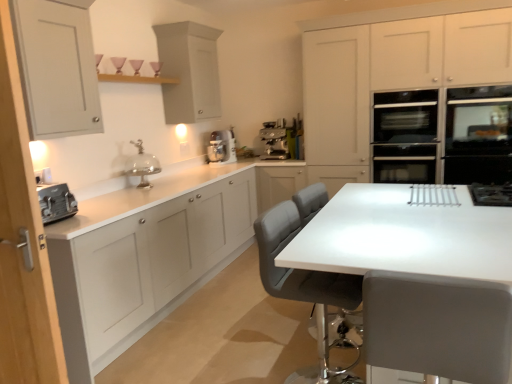
Find the location of a particular element. The width and height of the screenshot is (512, 384). satin silver espresso machine at center is located at coordinates (275, 141).

Measure the distance between point [127,285] and camera.

The depth of point [127,285] is 8.61 feet.

Locate an element on the screen. The height and width of the screenshot is (384, 512). white matte cabinetry at right, positioned as the fifth cabinetry in left-to-right order is located at coordinates (391, 70).

At what (x,y) coordinates should I click in order to perform the action: click on satin silver espresso machine at center. Please return your answer as a coordinate pair (x, y). The height and width of the screenshot is (384, 512). Looking at the image, I should click on (275, 141).

Is satin silver espresso machine at center turned away from white matte cabinetry at right, positioned as the fifth cabinetry in left-to-right order?

No, satin silver espresso machine at center's orientation is not away from white matte cabinetry at right, positioned as the fifth cabinetry in left-to-right order.

From the image's perspective, which one is positioned higher, satin silver espresso machine at center or white matte cabinetry at right, the first cabinetry from the right?

white matte cabinetry at right, the first cabinetry from the right, is shown above in the image.

Do you think satin silver espresso machine at center is within white matte cabinetry at right, the first cabinetry from the right, or outside of it?

The correct answer is: outside.

Considering the relative positions of satin silver espresso machine at center and white matte cabinetry at right, positioned as the fifth cabinetry in left-to-right order, in the image provided, is satin silver espresso machine at center to the left or to the right of white matte cabinetry at right, positioned as the fifth cabinetry in left-to-right order,?

Clearly, satin silver espresso machine at center is on the left of white matte cabinetry at right, positioned as the fifth cabinetry in left-to-right order, in the image.

Between silver metallic cake stand at center and matte white mixer at center, which one appears on the left side from the viewer's perspective?

silver metallic cake stand at center.

Which object is thinner, silver metallic cake stand at center or matte white mixer at center?

matte white mixer at center.

Is silver metallic cake stand at center not near matte white mixer at center?

Actually, silver metallic cake stand at center and matte white mixer at center are a little close together.

Measure the distance between silver metallic cake stand at center and matte white mixer at center.

silver metallic cake stand at center is 35.66 inches away from matte white mixer at center.

Looking at this image, does white matte cabinet at upper center, which ranks as the fourth cabinetry in left-to-right order, have a smaller size compared to white matte cabinet at left, the 3th cabinetry from the right?

Indeed, white matte cabinet at upper center, which ranks as the fourth cabinetry in left-to-right order, has a smaller size compared to white matte cabinet at left, the 3th cabinetry from the right.

Identify the location of cabinetry that is the 4th object located below the white matte cabinet at upper center, arranged as the 2th cabinetry when viewed from the right (from the image's perspective). The height and width of the screenshot is (384, 512). (145, 262).

Which of these two, white matte cabinet at upper center, arranged as the 2th cabinetry when viewed from the right, or white matte cabinet at left, the 3th cabinetry from the right, stands shorter?

Standing shorter between the two is white matte cabinet at upper center, arranged as the 2th cabinetry when viewed from the right.

From the image's perspective, between satin silver espresso machine at center and silver metallic cake stand at center, which one is located above?

satin silver espresso machine at center appears higher in the image.

What's the angular difference between satin silver espresso machine at center and silver metallic cake stand at center's facing directions?

There is a 90.3-degree angle between the facing directions of satin silver espresso machine at center and silver metallic cake stand at center.

This screenshot has height=384, width=512. Identify the location of faucet on the left of satin silver espresso machine at center. (141, 164).

Is satin silver espresso machine at center positioned with its back to silver metallic cake stand at center?

No, satin silver espresso machine at center's orientation is not away from silver metallic cake stand at center.

Between white matte cabinetry at right, the first cabinetry from the right, and white matte cabinet at left, the 3th cabinetry from the right, which one has smaller width?

white matte cabinet at left, the 3th cabinetry from the right, is thinner.

Is white matte cabinetry at right, the first cabinetry from the right, further to camera compared to white matte cabinet at left, the 3th cabinetry from the right?

A: Yes, it is behind white matte cabinet at left, the 3th cabinetry from the right.

Is white matte cabinetry at right, positioned as the fifth cabinetry in left-to-right order, far away from white matte cabinet at left, positioned as the 3th cabinetry in left-to-right order?

Yes.

Identify the location of cabinetry that is the 2nd object directly below the white matte cabinetry at right, positioned as the fifth cabinetry in left-to-right order (from a real-world perspective). The height and width of the screenshot is (384, 512). (145, 262).

How different are the orientations of black glass oven at right, the 2th oven viewed from the left, and black glass oven at right, arranged as the 2th oven when viewed from the right, in degrees?

0.000116 degrees separate the facing orientations of black glass oven at right, the 2th oven viewed from the left, and black glass oven at right, arranged as the 2th oven when viewed from the right.

Is black glass oven at right, acting as the first oven starting from the right, not close to black glass oven at right, which is the first oven in left-to-right order?

No, black glass oven at right, acting as the first oven starting from the right, is not far away from black glass oven at right, which is the first oven in left-to-right order.

Choose the correct answer: Is black glass oven at right, the 2th oven viewed from the left, inside black glass oven at right, arranged as the 2th oven when viewed from the right, or outside it?

black glass oven at right, the 2th oven viewed from the left, exists outside the volume of black glass oven at right, arranged as the 2th oven when viewed from the right.

Looking at this image, which object is further away from the camera, black glass oven at right, acting as the first oven starting from the right, or black glass oven at right, arranged as the 2th oven when viewed from the right?

black glass oven at right, arranged as the 2th oven when viewed from the right, is further from the camera.

Between gray leather chair at center, marked as the 1th chair in a back-to-front arrangement, and black glass oven at right, which is the first oven in left-to-right order, which one has less height?

black glass oven at right, which is the first oven in left-to-right order.

Is point (272, 269) closer to camera compared to point (397, 106)?

Yes, point (272, 269) is in front of point (397, 106).

Is gray leather chair at center, marked as the 1th chair in a back-to-front arrangement, wider than black glass oven at right, arranged as the 2th oven when viewed from the right?

Correct, the width of gray leather chair at center, marked as the 1th chair in a back-to-front arrangement, exceeds that of black glass oven at right, arranged as the 2th oven when viewed from the right.

From a real-world perspective, starting from the satin silver espresso machine at center, which cabinetry is the 1st one vertically above it? Please provide its 2D coordinates.

[(391, 70)]

Where is `faucet that is on the left side of matte white mixer at center`? The image size is (512, 384). faucet that is on the left side of matte white mixer at center is located at coordinates (141, 164).

When comparing their distances from white matte cabinetry at right, the first cabinetry from the right, does matte white toaster at left, which is the second cabinetry in left-to-right order, or black glass oven at right, which is the first oven in left-to-right order, seem further?

matte white toaster at left, which is the second cabinetry in left-to-right order, lies further to white matte cabinetry at right, the first cabinetry from the right, than the other object.

From the image, which object appears to be nearer to gray leather chair at center, positioned as the 2th chair in front-to-back order, black glass oven at right, arranged as the 2th oven when viewed from the right, or matte white toaster at left, which is the second cabinetry in left-to-right order?

matte white toaster at left, which is the second cabinetry in left-to-right order, lies closer to gray leather chair at center, positioned as the 2th chair in front-to-back order, than the other object.

Estimate the real-world distances between objects in this image. Which object is closer to white matte cabinet at left, the 3th cabinetry from the right, black glass oven at right, acting as the first oven starting from the right, or white matte cabinet at upper center, which ranks as the fourth cabinetry in left-to-right order?

white matte cabinet at upper center, which ranks as the fourth cabinetry in left-to-right order, is positioned closer to the anchor white matte cabinet at left, the 3th cabinetry from the right.

From the image, which object appears to be nearer to silver metallic cake stand at center, white matte cabinet at upper center, arranged as the 2th cabinetry when viewed from the right, or white glossy table at center?

Among the two, white matte cabinet at upper center, arranged as the 2th cabinetry when viewed from the right, is located nearer to silver metallic cake stand at center.

When comparing their distances from matte gray cabinet at upper left, the fifth cabinetry when ordered from right to left, does gray leather chair at center, positioned as the 2th chair in front-to-back order, or white matte cabinet at left, positioned as the 3th cabinetry in left-to-right order, seem closer?

white matte cabinet at left, positioned as the 3th cabinetry in left-to-right order, lies closer to matte gray cabinet at upper left, the fifth cabinetry when ordered from right to left, than the other object.

Considering their positions, is gray leather chair at center, marked as the 1th chair in a back-to-front arrangement, positioned further to matte gray cabinet at upper left, the 1th cabinetry from the left, than matte white toaster at left, placed as the 4th cabinetry when sorted from right to left?

gray leather chair at center, marked as the 1th chair in a back-to-front arrangement.

Considering their positions, is matte white mixer at center positioned further to white matte cabinetry at right, positioned as the fifth cabinetry in left-to-right order, than white glossy table at center?

The object further to white matte cabinetry at right, positioned as the fifth cabinetry in left-to-right order, is white glossy table at center.

Based on their spatial positions, is white matte cabinet at upper center, arranged as the 2th cabinetry when viewed from the right, or matte gray chair at center, arranged as the 1th chair when viewed from the front, further from matte gray cabinet at upper left, the fifth cabinetry when ordered from right to left?

matte gray chair at center, arranged as the 1th chair when viewed from the front, is further to matte gray cabinet at upper left, the fifth cabinetry when ordered from right to left.

Find the location of a particular element. This screenshot has width=512, height=384. table between silver metallic cake stand at center and white matte cabinetry at right, the first cabinetry from the right, from left to right is located at coordinates (394, 238).

Find the location of `faucet between matte gray cabinet at upper left, the fifth cabinetry when ordered from right to left, and matte gray chair at center, arranged as the 1th chair when viewed from the front`. faucet between matte gray cabinet at upper left, the fifth cabinetry when ordered from right to left, and matte gray chair at center, arranged as the 1th chair when viewed from the front is located at coordinates (141, 164).

Find the location of a particular element. The height and width of the screenshot is (384, 512). cabinetry situated between matte white mixer at center and black glass oven at right, the 2th oven viewed from the left, from left to right is located at coordinates (391, 70).

Identify the location of oven situated between white matte cabinet at upper center, which ranks as the fourth cabinetry in left-to-right order, and white matte cabinetry at right, the first cabinetry from the right, from left to right. (x=405, y=136).